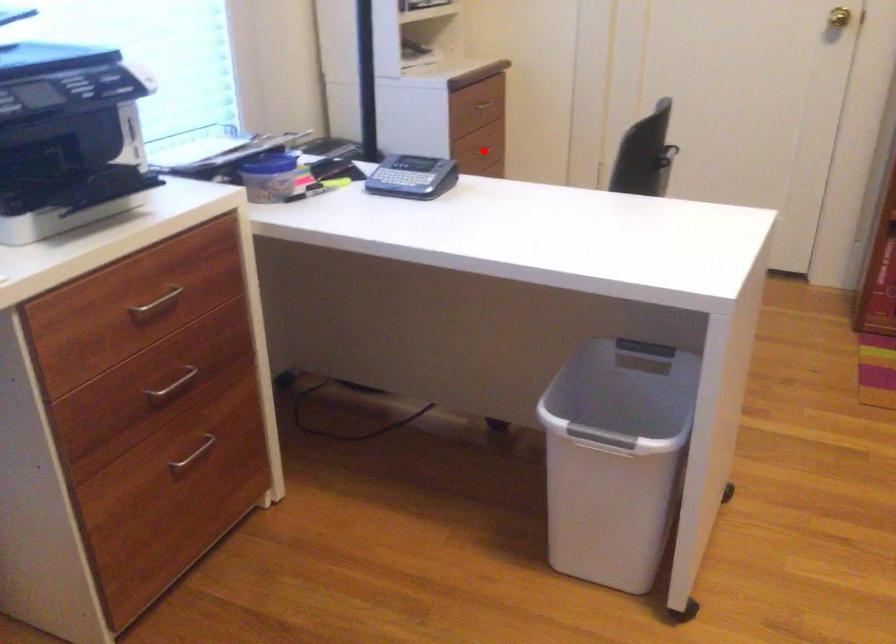
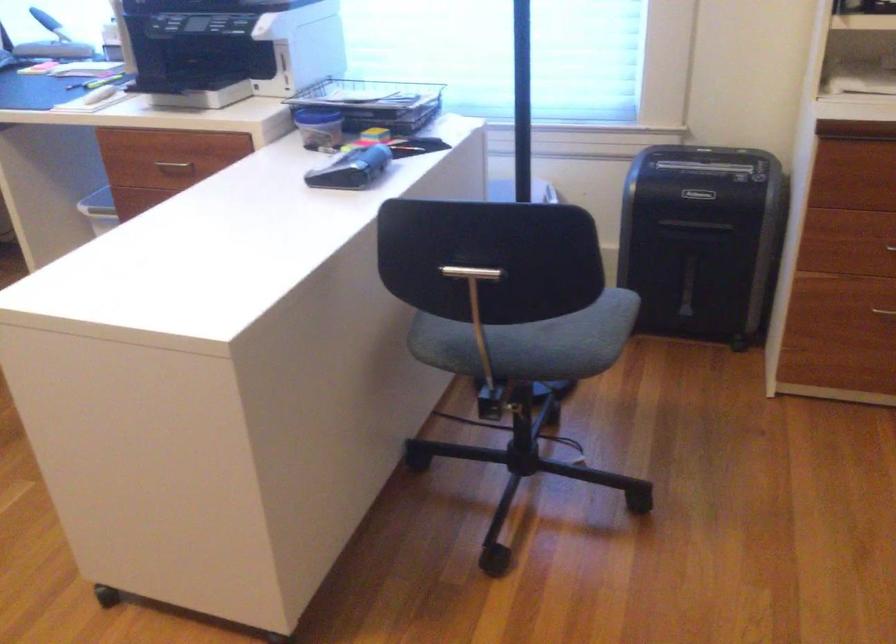
Question: A red point is marked in image1. In image2, is the corresponding 3D point closer to the camera or farther? Reply with the corresponding letter.

Choices:
 (A) The corresponding 3D point is closer.
 (B) The corresponding 3D point is farther.

Answer: (A)